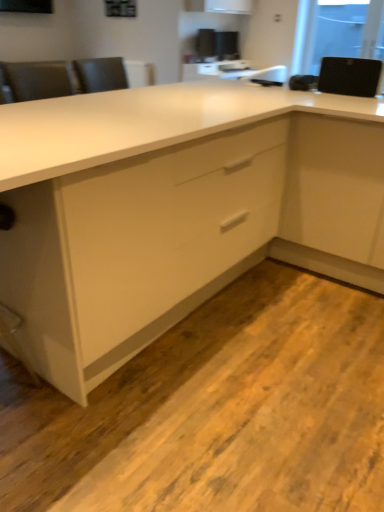
Question: Is white glossy cabinet at center at the back of transparent glass window screen at upper right?

Choices:
 (A) no
 (B) yes

Answer: (A)

Question: From the image's perspective, is transparent glass window screen at upper right located above white glossy cabinet at center?

Choices:
 (A) yes
 (B) no

Answer: (A)

Question: From a real-world perspective, is transparent glass window screen at upper right beneath white glossy cabinet at center?

Choices:
 (A) no
 (B) yes

Answer: (A)

Question: Does transparent glass window screen at upper right have a lesser height compared to white glossy cabinet at center?

Choices:
 (A) yes
 (B) no

Answer: (A)

Question: From the image's perspective, is transparent glass window screen at upper right beneath white glossy cabinet at center?

Choices:
 (A) no
 (B) yes

Answer: (A)

Question: Is black matte speaker at upper right bigger or smaller than transparent glass window screen at upper right?

Choices:
 (A) small
 (B) big

Answer: (A)

Question: In the image, is black matte speaker at upper right positioned in front of or behind transparent glass window screen at upper right?

Choices:
 (A) behind
 (B) front

Answer: (B)

Question: Does point (342, 57) appear closer or farther from the camera than point (352, 15)?

Choices:
 (A) closer
 (B) farther

Answer: (A)

Question: From a real-world perspective, is black matte speaker at upper right positioned above or below transparent glass window screen at upper right?

Choices:
 (A) below
 (B) above

Answer: (A)

Question: Is white glossy cabinet at center taller or shorter than transparent glass window screen at upper right?

Choices:
 (A) tall
 (B) short

Answer: (A)

Question: From a real-world perspective, is white glossy cabinet at center physically located above or below transparent glass window screen at upper right?

Choices:
 (A) above
 (B) below

Answer: (B)

Question: Is point (213, 124) positioned closer to the camera than point (370, 50)?

Choices:
 (A) closer
 (B) farther

Answer: (A)

Question: Would you say white glossy cabinet at center is inside or outside transparent glass window screen at upper right?

Choices:
 (A) inside
 (B) outside

Answer: (B)

Question: From the image's perspective, relative to black matte speaker at upper right, is transparent glass window screen at upper right above or below?

Choices:
 (A) below
 (B) above

Answer: (B)

Question: Considering the positions of point (372, 6) and point (332, 88), is point (372, 6) closer or farther from the camera than point (332, 88)?

Choices:
 (A) closer
 (B) farther

Answer: (B)